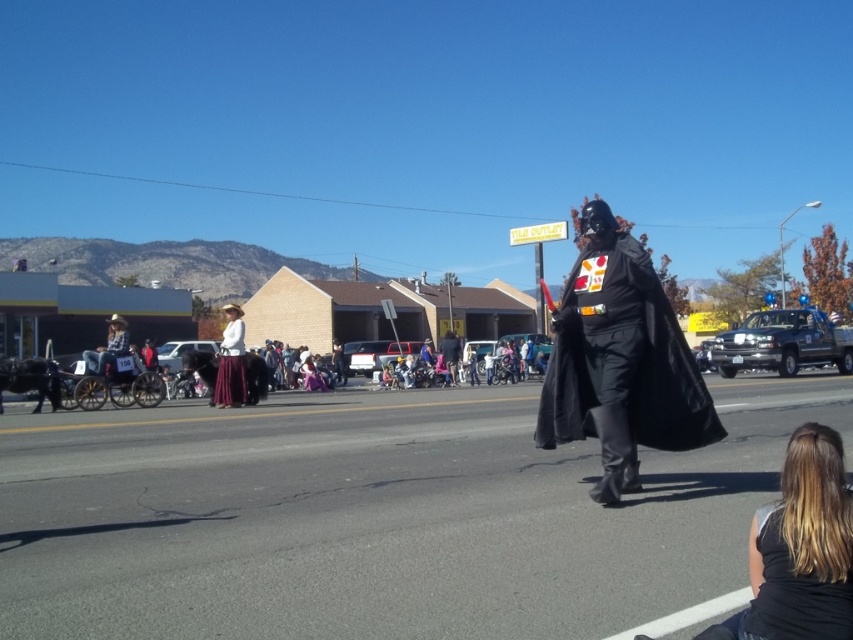
Question: Does black matte cape at center lie behind matte white shirt at center?

Choices:
 (A) no
 (B) yes

Answer: (A)

Question: Can you confirm if black matte cape at center is bigger than matte black costume at center?

Choices:
 (A) yes
 (B) no

Answer: (B)

Question: Which object appears closest to the camera in this image?

Choices:
 (A) matte black costume at center
 (B) blonde hair at lower right
 (C) black matte cape at center
 (D) matte white shirt at center

Answer: (B)

Question: Which of the following is the closest to the observer?

Choices:
 (A) matte white shirt at center
 (B) blonde hair at lower right
 (C) matte black costume at center
 (D) black matte cape at center

Answer: (B)

Question: Which of the following is the farthest from the observer?

Choices:
 (A) matte white shirt at center
 (B) black matte cape at center

Answer: (A)

Question: Can you confirm if black matte cape at center is positioned to the right of blonde hair at lower right?

Choices:
 (A) yes
 (B) no

Answer: (A)